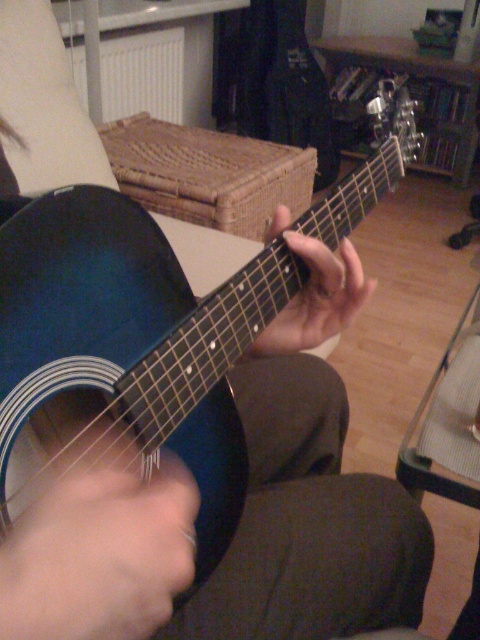
Who is more distant from viewer, (57,560) or (133,48)?

Point (133,48)

Who is positioned more to the left, matte black guitar at lower left or white matte radiator at upper left?

From the viewer's perspective, white matte radiator at upper left appears more on the left side.

Who is more distant from viewer, (166,474) or (149,92)?

Positioned behind is point (149,92).

I want to click on matte black guitar at lower left, so click(99, 556).

Does shiny blue acoustic guitar at center have a larger size compared to matte black guitar at lower left?

Indeed, shiny blue acoustic guitar at center has a larger size compared to matte black guitar at lower left.

Is point (226, 464) positioned in front of point (1, 588)?

No, (226, 464) is behind (1, 588).

At what (x,y) coordinates should I click in order to perform the action: click on shiny blue acoustic guitar at center. Please return your answer as a coordinate pair (x, y). Looking at the image, I should click on (128, 346).

Measure the distance between matte black guitar at lower left and matte black guitar at center.

matte black guitar at lower left is 10.54 inches away from matte black guitar at center.

Between matte black guitar at lower left and matte black guitar at center, which one has more height?

matte black guitar at center is taller.

Between point (86, 593) and point (296, 252), which one is positioned behind?

Positioned behind is point (296, 252).

Where is `matte black guitar at lower left`? The width and height of the screenshot is (480, 640). matte black guitar at lower left is located at coordinates (99, 556).